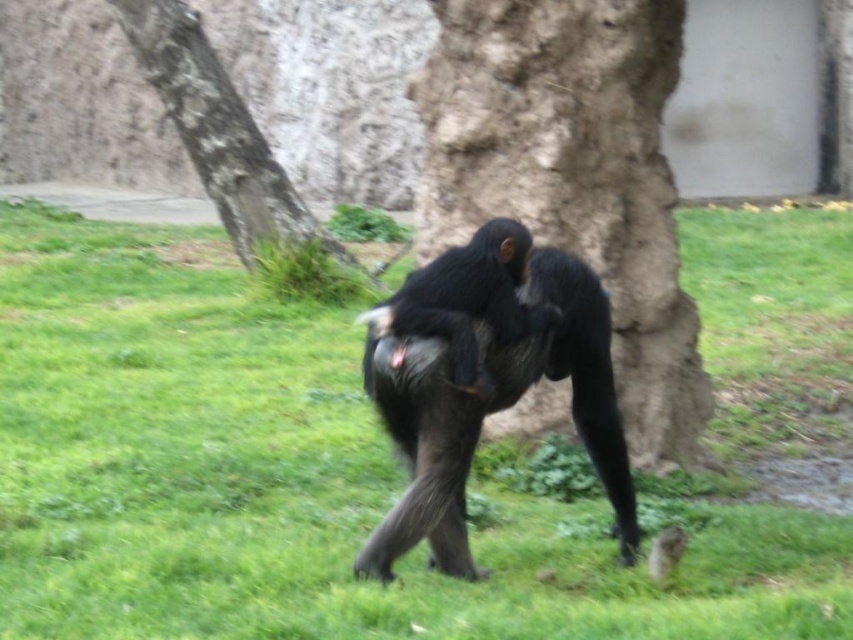
Question: Does shiny black monkey at center appear under rough bark tree at upper left?

Choices:
 (A) yes
 (B) no

Answer: (A)

Question: Which of the following is the closest to the observer?

Choices:
 (A) (526, 500)
 (B) (248, 216)
 (C) (636, 84)
 (D) (621, 470)

Answer: (D)

Question: Which point appears closest to the camera in this image?

Choices:
 (A) (271, 209)
 (B) (329, 536)
 (C) (558, 280)
 (D) (630, 193)

Answer: (C)

Question: Is rough bark tree trunk at center smaller than shiny black monkey at center?

Choices:
 (A) yes
 (B) no

Answer: (B)

Question: Does shiny black monkey at center appear on the left side of rough bark tree at upper left?

Choices:
 (A) yes
 (B) no

Answer: (B)

Question: Which point appears closest to the camera in this image?

Choices:
 (A) (389, 532)
 (B) (547, 58)
 (C) (61, 609)
 (D) (215, 58)

Answer: (C)